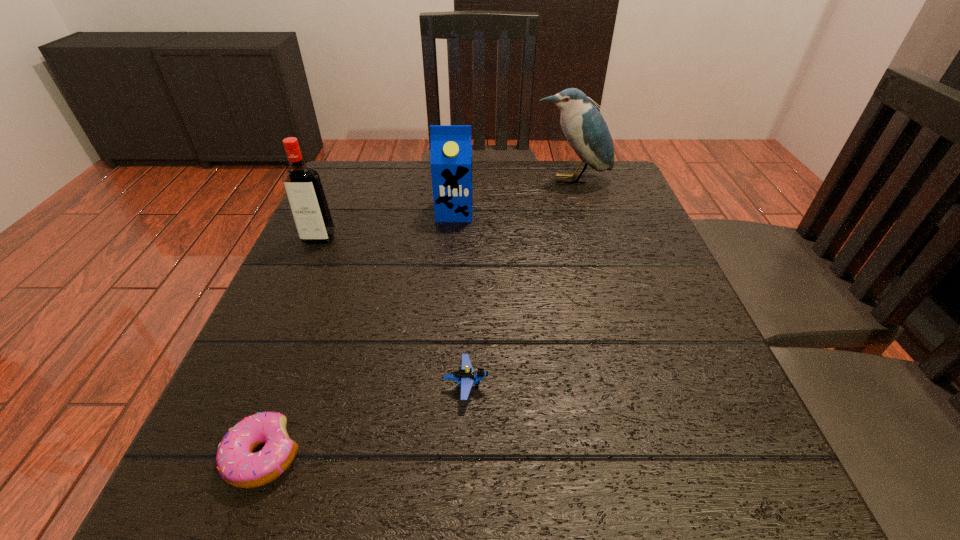
Locate an element on the screen. vacant area at the far edge of the desktop is located at coordinates (421, 208).

In the image, there is a desktop. Identify the location of free space at the left edge. (276, 294).

Identify the location of free space at the right edge. Image resolution: width=960 pixels, height=540 pixels. (684, 318).

Where is `vacant space at the far left corner of the desktop`? Image resolution: width=960 pixels, height=540 pixels. vacant space at the far left corner of the desktop is located at coordinates (341, 194).

You are a GUI agent. You are given a task and a screenshot of the screen. Output one action in this format:
    pyautogui.click(x=<x>, y=<y>)
    Task: Click on the vacant area at the near left corner
    
    Given the screenshot: What is the action you would take?
    pyautogui.click(x=201, y=504)

Identify the location of vacant position at the far right corner of the desktop. Image resolution: width=960 pixels, height=540 pixels. (584, 173).

At what (x,y) coordinates should I click in order to perform the action: click on free space that is in between the doughnut and the rightmost object. Please return your answer as a coordinate pair (x, y). This screenshot has width=960, height=540. Looking at the image, I should click on pyautogui.click(x=418, y=318).

Where is `vacant area between the second nearest object and the vodka`? vacant area between the second nearest object and the vodka is located at coordinates (393, 312).

Locate an element on the screen. vacant space that's between the vodka and the shortest object is located at coordinates (291, 347).

You are a GUI agent. You are given a task and a screenshot of the screen. Output one action in this format:
    pyautogui.click(x=<x>, y=<y>)
    Task: Click on the vacant space that is in between the Lego and the third farthest object
    The height and width of the screenshot is (540, 960).
    Given the screenshot: What is the action you would take?
    [x=393, y=312]